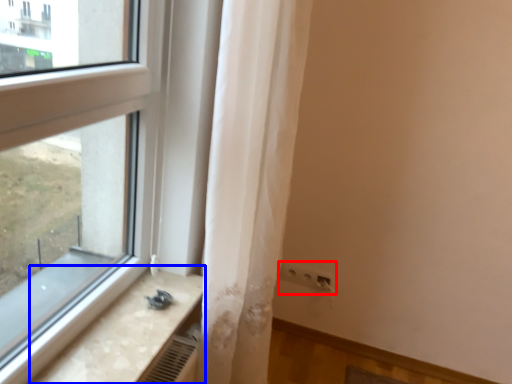
Question: Which of the following is the farthest to the observer, electric outlet (highlighted by a red box) or counter top (highlighted by a blue box)?

Choices:
 (A) electric outlet
 (B) counter top

Answer: (A)